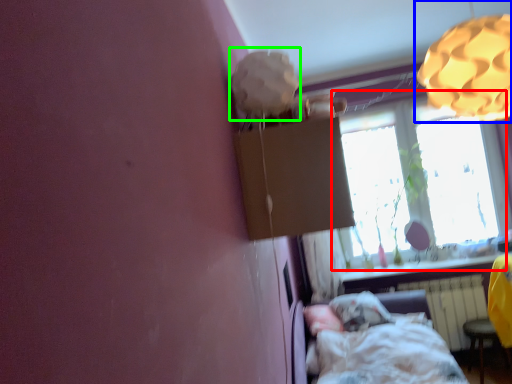
Question: Considering the real-world distances, which object is farthest from window (highlighted by a red box)? lamp (highlighted by a blue box) or lamp (highlighted by a green box)?

Choices:
 (A) lamp
 (B) lamp

Answer: (B)